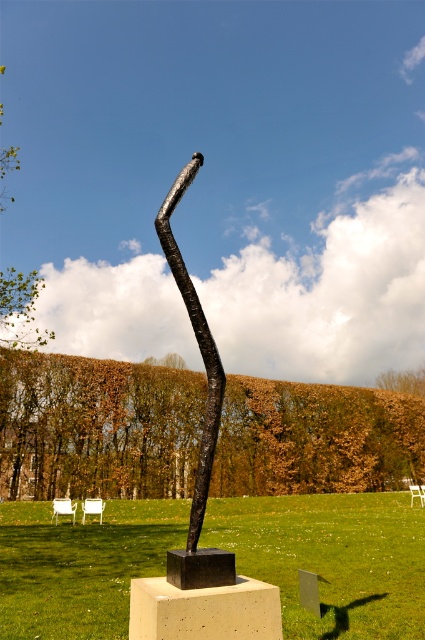
Can you confirm if green grass at center is shorter than black textured pole at center?

In fact, green grass at center may be taller than black textured pole at center.

Does point (62, 564) come behind point (226, 572)?

Yes, point (62, 564) is behind point (226, 572).

Does point (8, 570) come farther from viewer compared to point (186, 566)?

Yes, point (8, 570) is farther from viewer.

I want to click on green grass at center, so click(x=331, y=557).